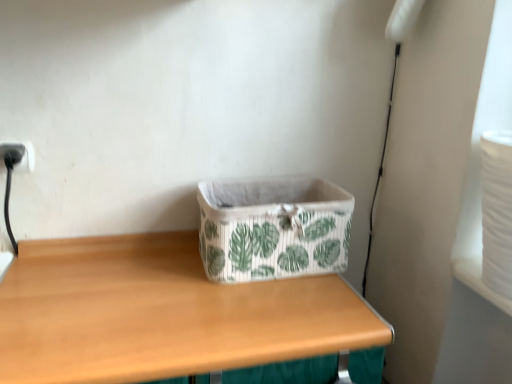
Question: Is white fabric storage box at center with black plastic electric outlet at upper left?

Choices:
 (A) no
 (B) yes

Answer: (A)

Question: Does white fabric storage box at center come in front of black plastic electric outlet at upper left?

Choices:
 (A) yes
 (B) no

Answer: (A)

Question: Considering the relative sizes of white fabric storage box at center and black plastic electric outlet at upper left in the image provided, is white fabric storage box at center taller than black plastic electric outlet at upper left?

Choices:
 (A) yes
 (B) no

Answer: (A)

Question: From a real-world perspective, does white fabric storage box at center sit lower than black plastic electric outlet at upper left?

Choices:
 (A) yes
 (B) no

Answer: (A)

Question: Considering the relative sizes of white fabric storage box at center and black plastic electric outlet at upper left in the image provided, is white fabric storage box at center thinner than black plastic electric outlet at upper left?

Choices:
 (A) no
 (B) yes

Answer: (A)

Question: Is white fabric storage box at center facing towards black plastic electric outlet at upper left?

Choices:
 (A) no
 (B) yes

Answer: (A)

Question: Is wooden table at center outside of black plastic electric outlet at upper left?

Choices:
 (A) no
 (B) yes

Answer: (B)

Question: Is wooden table at center wider than black plastic electric outlet at upper left?

Choices:
 (A) no
 (B) yes

Answer: (B)

Question: Can you confirm if wooden table at center is smaller than black plastic electric outlet at upper left?

Choices:
 (A) yes
 (B) no

Answer: (B)

Question: Can you confirm if wooden table at center is positioned to the left of black plastic electric outlet at upper left?

Choices:
 (A) yes
 (B) no

Answer: (B)

Question: From the image's perspective, does wooden table at center appear higher than black plastic electric outlet at upper left?

Choices:
 (A) yes
 (B) no

Answer: (B)

Question: Is wooden table at center oriented towards black plastic electric outlet at upper left?

Choices:
 (A) yes
 (B) no

Answer: (B)

Question: From the image's perspective, is wooden table at center below white fabric storage box at center?

Choices:
 (A) yes
 (B) no

Answer: (A)